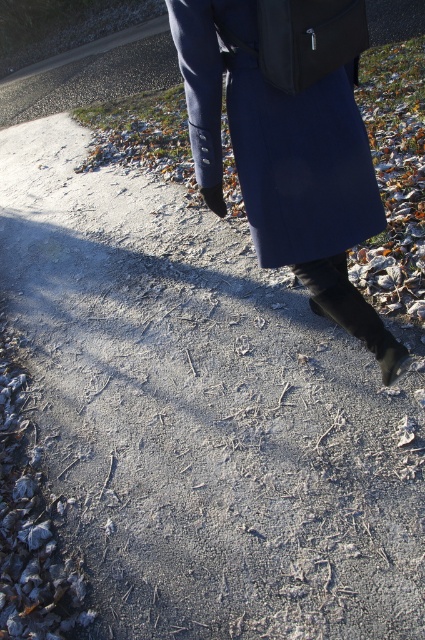
You are a pedestrian trying to avoid stepping on the matte black bag at center while walking on the path. Which direction should you move to ensure you step around the black suede boot at lower center instead?

The matte black bag at center is above the black suede boot at lower center, so to avoid stepping on the bag, you should move downward to step around the boot.

You are a tailor who needs to determine if the navy wool coat at center can fit into a storage box designed for shoes. The box is sized to accommodate the black suede boot at lower center. Based on the scene, can the coat fit inside the box?

The navy wool coat at center might be wider than the black suede boot at lower center, so it is unlikely to fit into a storage box designed for the boot.

You are a delivery person who needs to check the height of your matte black bag at center and black suede boot at lower center to ensure they can both fit through a narrow doorway. Which object is shorter and therefore might be easier to maneuver through the doorway?

The matte black bag at center is shorter than the black suede boot at lower center, so it might be easier to maneuver through the doorway.